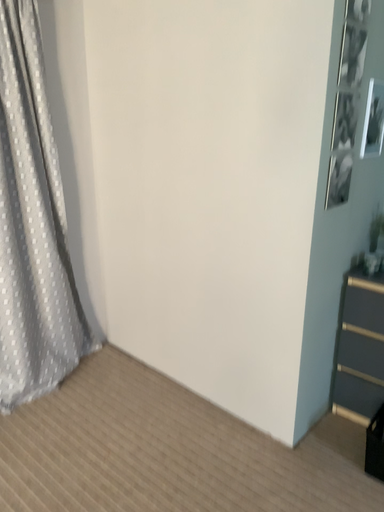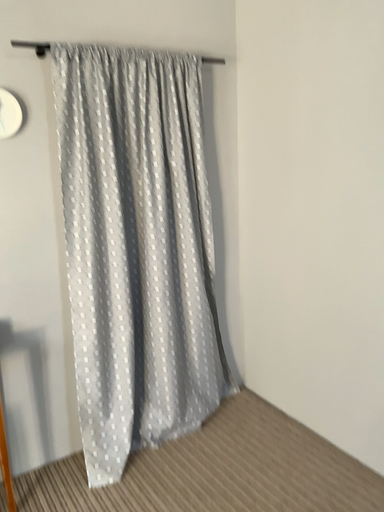
Question: Which way did the camera rotate in the video?

Choices:
 (A) rotated downward
 (B) rotated upward

Answer: (B)